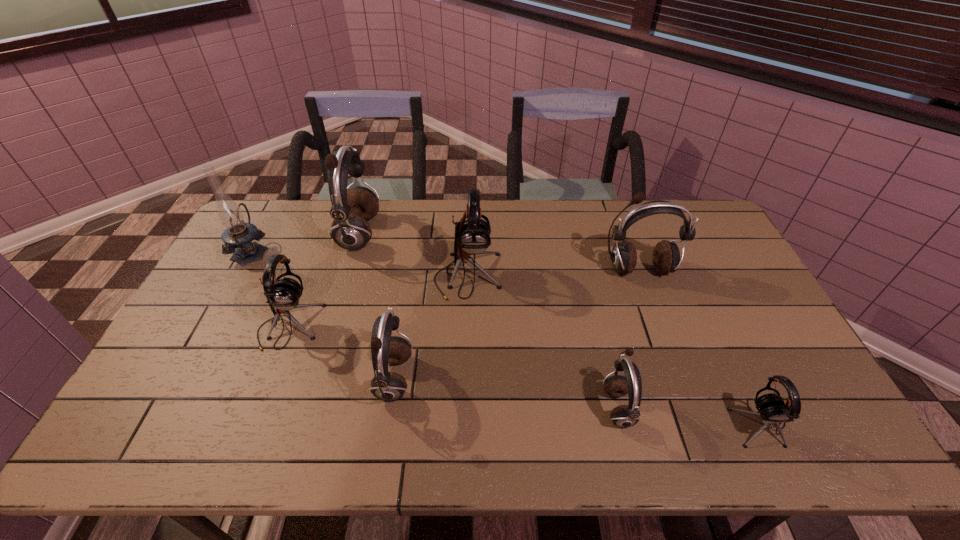
In the image, there is a desktop. Where is `free space at the far edge`? Image resolution: width=960 pixels, height=540 pixels. free space at the far edge is located at coordinates (506, 237).

Find the location of a particular element. vacant space at the near edge of the desktop is located at coordinates (215, 443).

In the image, there is a desktop. At what (x,y) coordinates should I click in order to perform the action: click on vacant space at the left edge. Please return your answer as a coordinate pair (x, y). Looking at the image, I should click on (194, 420).

In the image, there is a desktop. Find the location of `vacant space at the right edge`. vacant space at the right edge is located at coordinates (710, 251).

Identify the location of vacant area at the far right corner of the desktop. The image size is (960, 540). (697, 213).

Where is `empty space between the rightmost black earphone and the second biggest black earphone`? The height and width of the screenshot is (540, 960). empty space between the rightmost black earphone and the second biggest black earphone is located at coordinates (524, 374).

Identify the location of empty space that is in between the fifth earphone from right to left and the rightmost brown earphone. (516, 325).

Where is `free spot between the third smallest brown earphone and the rightmost black earphone`? The height and width of the screenshot is (540, 960). free spot between the third smallest brown earphone and the rightmost black earphone is located at coordinates (699, 346).

The image size is (960, 540). I want to click on vacant area between the second farthest black earphone and the fifth earphone from left to right, so click(453, 367).

Identify the location of vacant point located between the third brown earphone from left to right and the nearest black earphone. This screenshot has height=540, width=960. (688, 414).